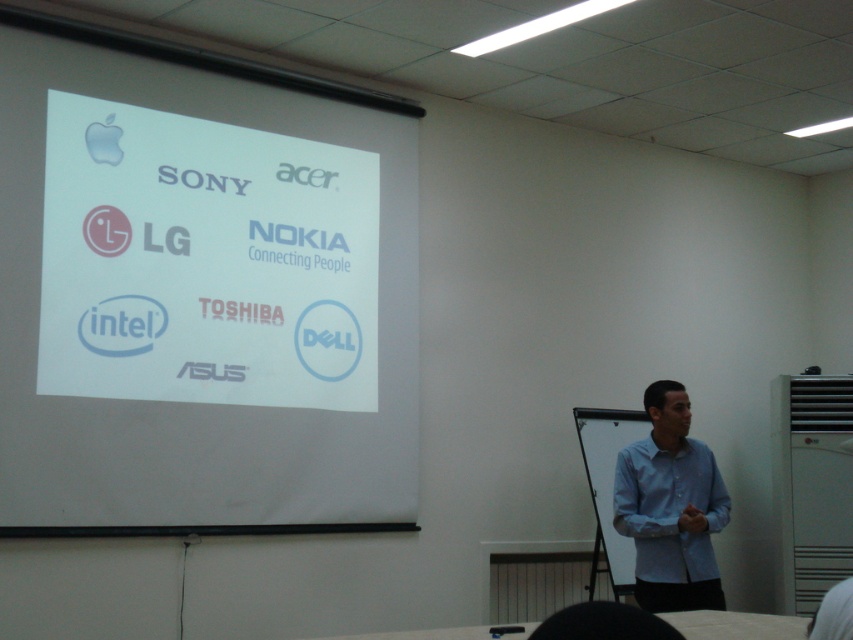
Question: Among these points, which one is farthest from the camera?

Choices:
 (A) [x=242, y=432]
 (B) [x=653, y=474]

Answer: (B)

Question: Among these objects, which one is nearest to the camera?

Choices:
 (A) light blue cotton shirt at lower right
 (B) white paper at upper left

Answer: (B)

Question: Does white paper at upper left have a larger size compared to light blue cotton shirt at lower right?

Choices:
 (A) no
 (B) yes

Answer: (B)

Question: Is white paper at upper left in front of light blue cotton shirt at lower right?

Choices:
 (A) no
 (B) yes

Answer: (B)

Question: Among these objects, which one is farthest from the camera?

Choices:
 (A) light blue cotton shirt at lower right
 (B) white paper at upper left

Answer: (A)

Question: Does white paper at upper left appear on the right side of light blue cotton shirt at lower right?

Choices:
 (A) no
 (B) yes

Answer: (A)